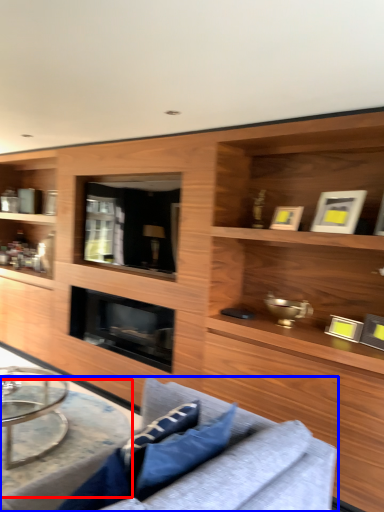
Question: Which of the following is the farthest to the observer, round table (highlighted by a red box) or studio couch (highlighted by a blue box)?

Choices:
 (A) round table
 (B) studio couch

Answer: (A)